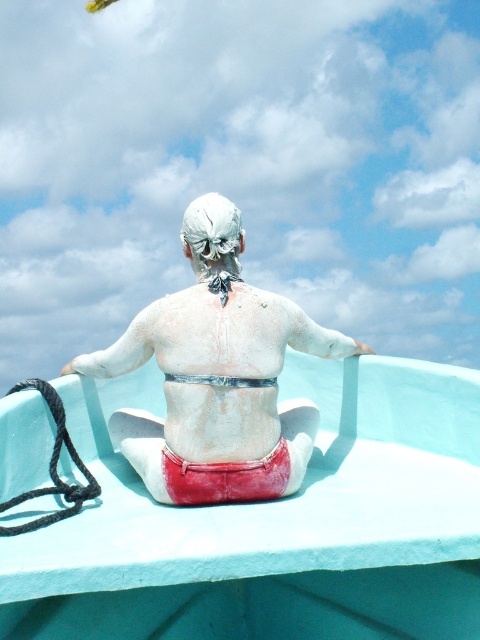
You are a lifeguard observing the scene from the shore. You notice the teal plastic boat at center and the white matte man at center. Which object takes up more space in the image?

The teal plastic boat at center is larger in size than the white matte man at center, so it takes up more space in the image.

You are standing on the dock and looking at the point marked as point [168,582] in the image. If you want to throw a lifebuoy to reach that point, and the lifebuoy has a diameter of 0.8 meters, will it cover the point completely?

The point marked as point [168,582] is 1.09 meters away from the camera. The lifebuoy has a diameter of 0.8 meters, so it can cover the point completely if thrown accurately.

You are observing a person in a boat. There are two points marked on the boat. The first point is at coordinate point (263, 563) and the second point is at coordinate point (227, 464). Which point is closer to you?

Point (263, 563) is closer to the viewer than point (227, 464).